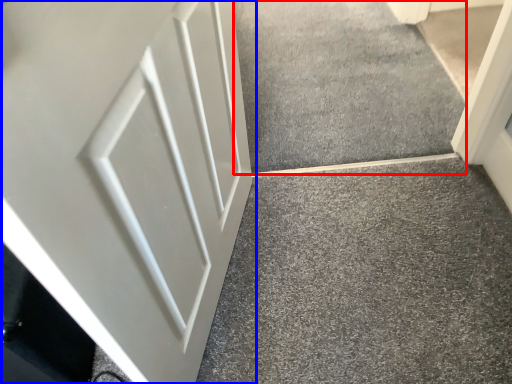
Question: Which object appears farthest to the camera in this image, concrete (highlighted by a red box) or door (highlighted by a blue box)?

Choices:
 (A) concrete
 (B) door

Answer: (A)